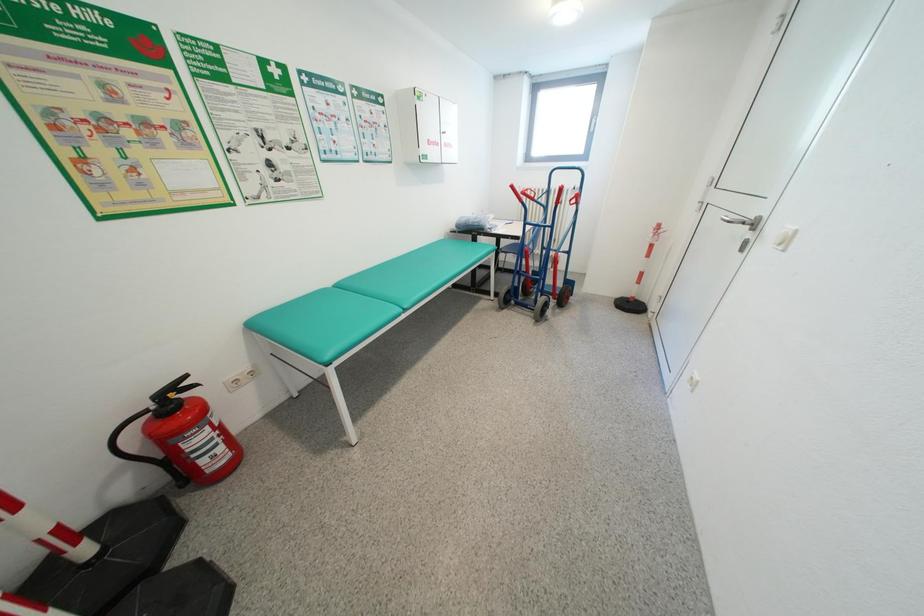
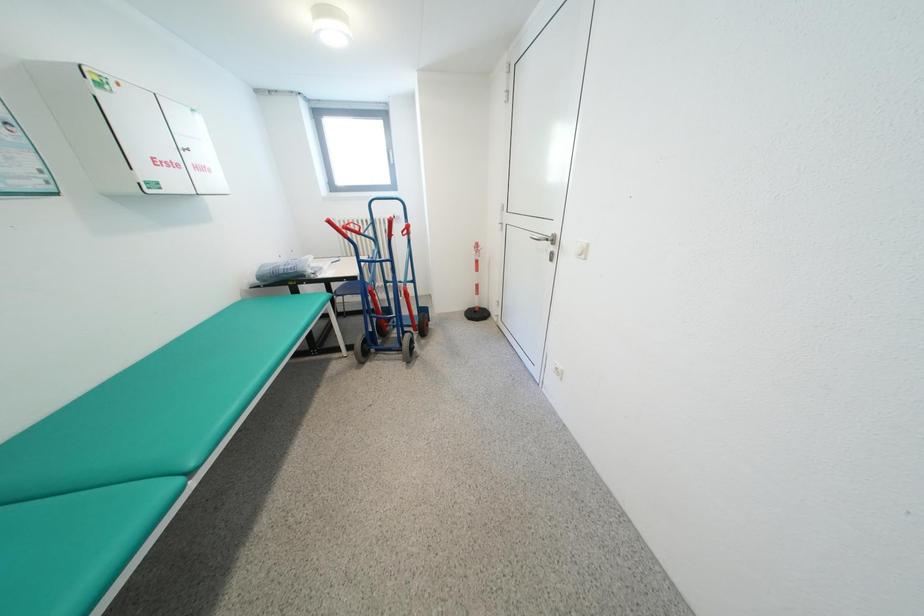
Question: Based on the continuous images, in which direction is the camera rotating? Reply with the corresponding letter.

Choices:
 (A) Left
 (B) Right
 (C) Up
 (D) Down

Answer: (B)